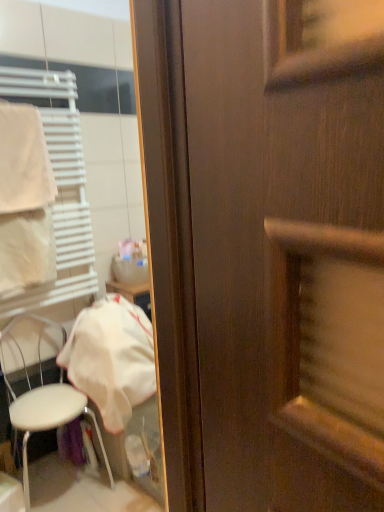
Find the location of `vacant space underneath white fabric towel at left (from a real-world perspective)`. vacant space underneath white fabric towel at left (from a real-world perspective) is located at coordinates (26, 214).